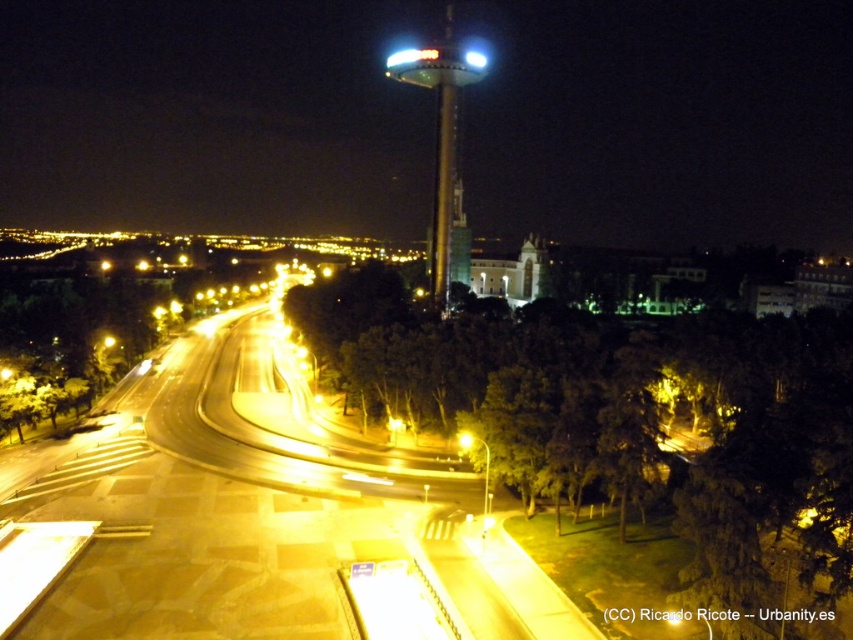
Question: Does shiny metallic tower at center have a smaller size compared to yellow metallic streetlight at center?

Choices:
 (A) no
 (B) yes

Answer: (A)

Question: Is shiny metallic tower at center smaller than yellow metallic streetlight at center?

Choices:
 (A) no
 (B) yes

Answer: (A)

Question: Can you confirm if shiny metallic tower at center is thinner than yellow metallic streetlight at center?

Choices:
 (A) yes
 (B) no

Answer: (B)

Question: Which point appears closest to the camera in this image?

Choices:
 (A) (459, 435)
 (B) (473, 61)

Answer: (A)